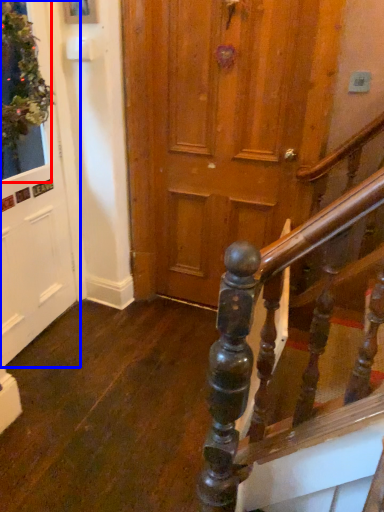
Question: Which point is closer to the camera, window (highlighted by a red box) or door (highlighted by a blue box)?

Choices:
 (A) window
 (B) door

Answer: (A)